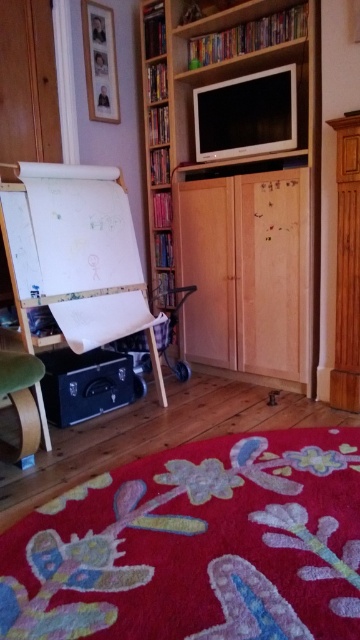
Can you confirm if white matte easel at left is positioned above wooden bookshelf at center?

Incorrect, white matte easel at left is not positioned above wooden bookshelf at center.

Which is behind, point (69, 173) or point (168, 275)?

The point (168, 275) is behind.

Where is `white matte easel at left`? The width and height of the screenshot is (360, 640). white matte easel at left is located at coordinates (75, 253).

Is wooden bookshelf at center smaller than green fabric chair at lower left?

No, wooden bookshelf at center is not smaller than green fabric chair at lower left.

Does wooden bookshelf at center appear on the right side of green fabric chair at lower left?

Correct, you'll find wooden bookshelf at center to the right of green fabric chair at lower left.

Who is more distant from viewer, (x=144, y=116) or (x=10, y=396)?

The point (x=144, y=116) is behind.

Locate an element on the screen. The image size is (360, 640). wooden bookshelf at center is located at coordinates (156, 140).

Where is `wooden bookcase at center`? wooden bookcase at center is located at coordinates pyautogui.click(x=236, y=189).

Is wooden bookcase at center further to camera compared to wooden bookshelf at center?

No, wooden bookcase at center is in front of wooden bookshelf at center.

Identify the location of wooden bookcase at center. (236, 189).